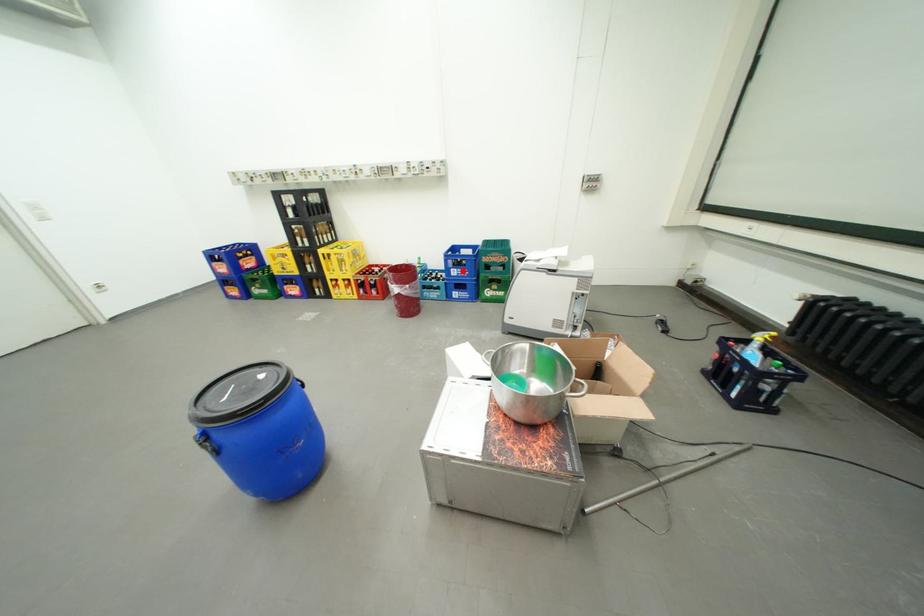
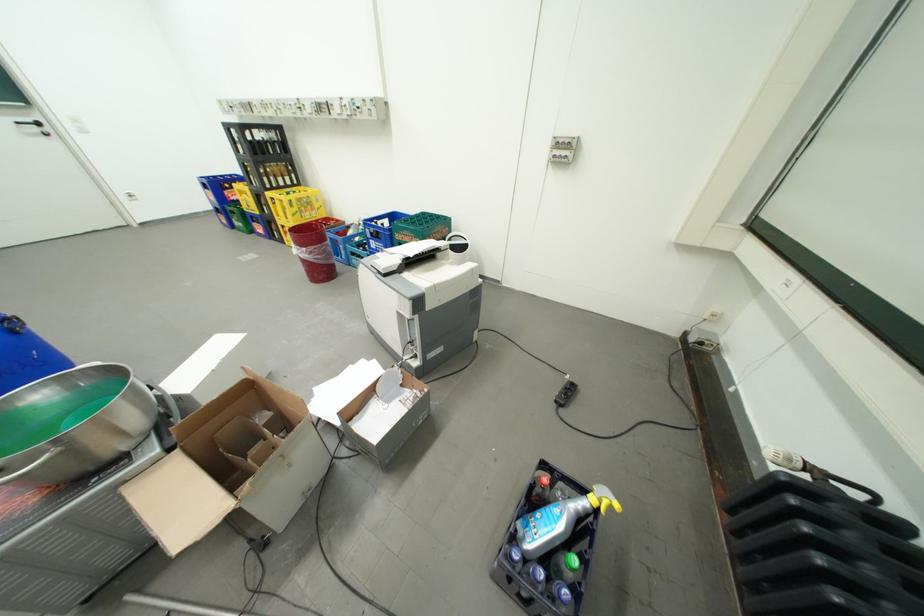
Locate, in the second image, the point that corresponds to the highlighted location in the first image.

(381, 241)